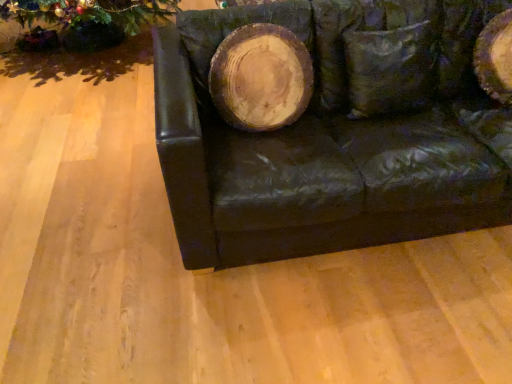
The width and height of the screenshot is (512, 384). Describe the element at coordinates (335, 134) in the screenshot. I see `matte black leather couch at center` at that location.

The width and height of the screenshot is (512, 384). What are the coordinates of `matte black leather couch at center` in the screenshot? It's located at (335, 134).

In order to face matte black leather couch at center, should I rotate leftwards or rightwards?

Rotate your view right by about 17.998°.

Where is `matte black leather couch at center`? The image size is (512, 384). matte black leather couch at center is located at coordinates (335, 134).